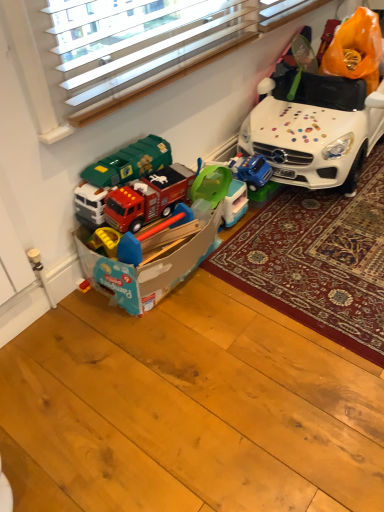
Question: Is white carpet at center thinner than matte plastic toy box at lower left, placed as the second toy when sorted from back to front?

Choices:
 (A) yes
 (B) no

Answer: (B)

Question: From the image's perspective, does white carpet at center appear higher than matte plastic toy box at lower left, placed as the second toy when sorted from back to front?

Choices:
 (A) no
 (B) yes

Answer: (B)

Question: Is white carpet at center facing away from matte plastic toy box at lower left, marked as the 1th toy in a front-to-back arrangement?

Choices:
 (A) no
 (B) yes

Answer: (A)

Question: From a real-world perspective, is white carpet at center physically below matte plastic toy box at lower left, marked as the 1th toy in a front-to-back arrangement?

Choices:
 (A) no
 (B) yes

Answer: (B)

Question: Is white carpet at center to the left of matte plastic toy box at lower left, marked as the 1th toy in a front-to-back arrangement, from the viewer's perspective?

Choices:
 (A) yes
 (B) no

Answer: (B)

Question: Is white carpet at center to the right of matte plastic toy box at lower left, placed as the second toy when sorted from back to front, from the viewer's perspective?

Choices:
 (A) no
 (B) yes

Answer: (B)

Question: From the image's perspective, is green plastic toy at center, arranged as the 1th toy when viewed from the back, above white glossy toy car at upper right?

Choices:
 (A) yes
 (B) no

Answer: (B)

Question: Can you confirm if green plastic toy at center, arranged as the 1th toy when viewed from the back, is taller than white glossy toy car at upper right?

Choices:
 (A) no
 (B) yes

Answer: (A)

Question: From a real-world perspective, is green plastic toy at center, acting as the second toy starting from the front, below white glossy toy car at upper right?

Choices:
 (A) yes
 (B) no

Answer: (A)

Question: From a real-world perspective, is green plastic toy at center, arranged as the 1th toy when viewed from the back, located higher than white glossy toy car at upper right?

Choices:
 (A) no
 (B) yes

Answer: (A)

Question: Is the depth of green plastic toy at center, arranged as the 1th toy when viewed from the back, less than that of white glossy toy car at upper right?

Choices:
 (A) yes
 (B) no

Answer: (B)

Question: Is green plastic toy at center, arranged as the 1th toy when viewed from the back, not within white glossy toy car at upper right?

Choices:
 (A) no
 (B) yes

Answer: (B)

Question: From the image's perspective, does white carpet at center appear lower than white glossy toy car at upper right?

Choices:
 (A) no
 (B) yes

Answer: (B)